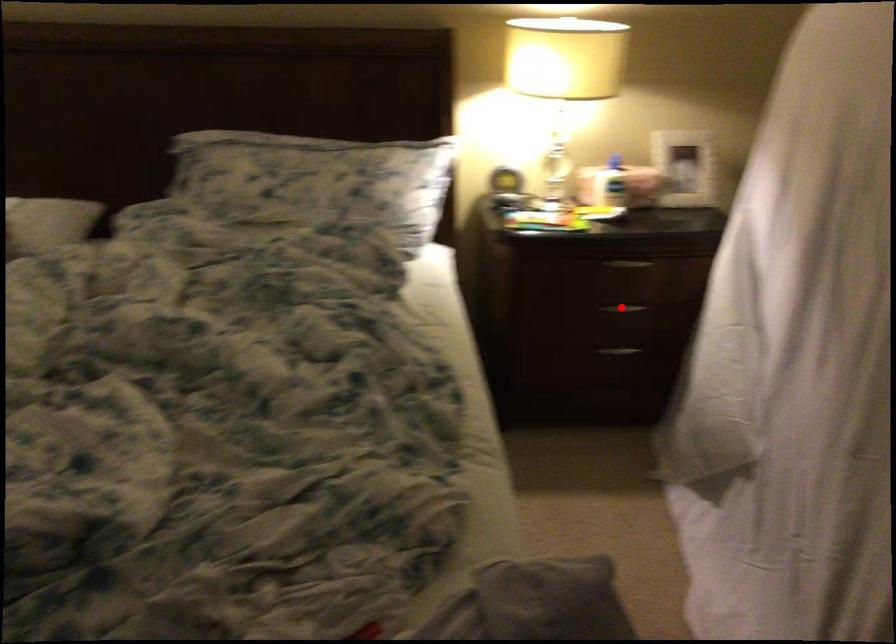
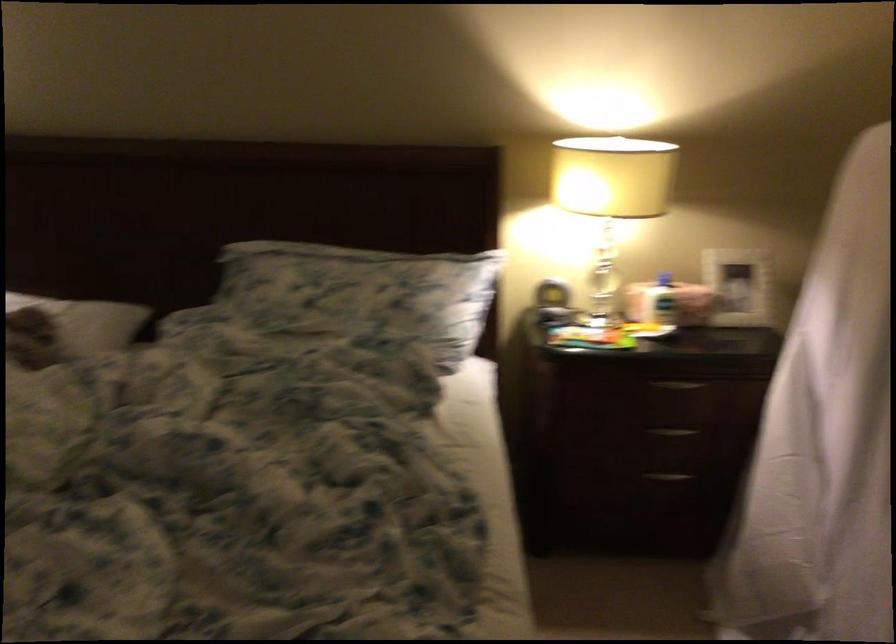
Where in the second image is the point corresponding to the highlighted location from the first image?

(672, 431)